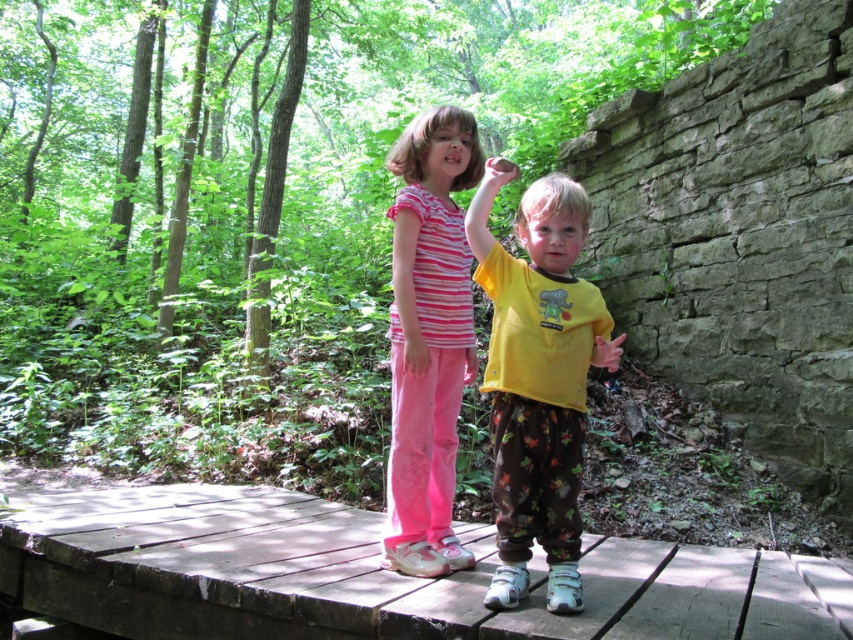
Question: Is yellow matte shirt at center closer to camera compared to striped cotton shirt at center?

Choices:
 (A) yes
 (B) no

Answer: (A)

Question: Which point is farther to the camera?

Choices:
 (A) (674, 611)
 (B) (585, 202)
 (C) (463, 552)

Answer: (C)

Question: Which object is positioned closest to the wooden planks at center?

Choices:
 (A) striped cotton shirt at center
 (B) yellow matte shirt at center

Answer: (A)

Question: Estimate the real-world distances between objects in this image. Which object is farther from the striped cotton shirt at center?

Choices:
 (A) wooden planks at center
 (B) yellow matte shirt at center

Answer: (A)

Question: Is wooden planks at center behind yellow matte shirt at center?

Choices:
 (A) yes
 (B) no

Answer: (B)

Question: Where is wooden planks at center located in relation to yellow matte shirt at center in the image?

Choices:
 (A) above
 (B) below

Answer: (B)